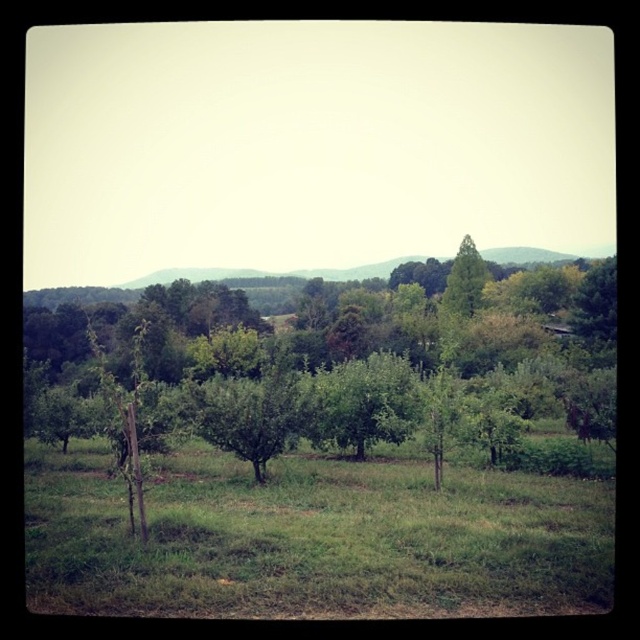
You are standing at the point marked as point (353, 372) in the image. What can you see directly in front of you?

You can see a green leafy tree at center directly in front of you at point (353, 372).

You are standing at the origin point in the orchard and see two points marked in the image. Which point is closer to you, point (220, 346) or point (602, 566)?

Point (602, 566) is closer to you because it is in front of point (220, 346) according to their spatial arrangement.